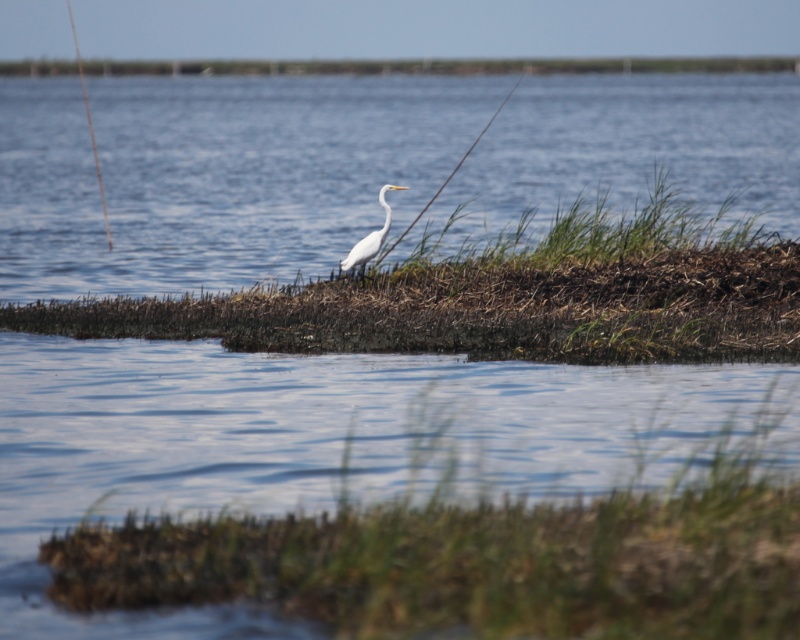
Does green grass at lower center have a lesser width compared to white matte bird at center?

In fact, green grass at lower center might be wider than white matte bird at center.

Where is `green grass at lower center`? The height and width of the screenshot is (640, 800). green grass at lower center is located at coordinates (478, 556).

Which is behind, point (374, 600) or point (604, 352)?

Positioned behind is point (604, 352).

Does green grass at lower center have a smaller size compared to green grassy patch at center?

Incorrect, green grass at lower center is not smaller in size than green grassy patch at center.

Who is more distant from viewer, (332, 563) or (596, 200)?

Positioned behind is point (596, 200).

Locate an element on the screen. green grass at lower center is located at coordinates (478, 556).

Which of these two, green grassy patch at center or white matte bird at center, stands shorter?

green grassy patch at center is shorter.

Can you confirm if green grassy patch at center is taller than white matte bird at center?

No.

Find the location of a particular element. This screenshot has height=640, width=800. green grassy patch at center is located at coordinates (505, 296).